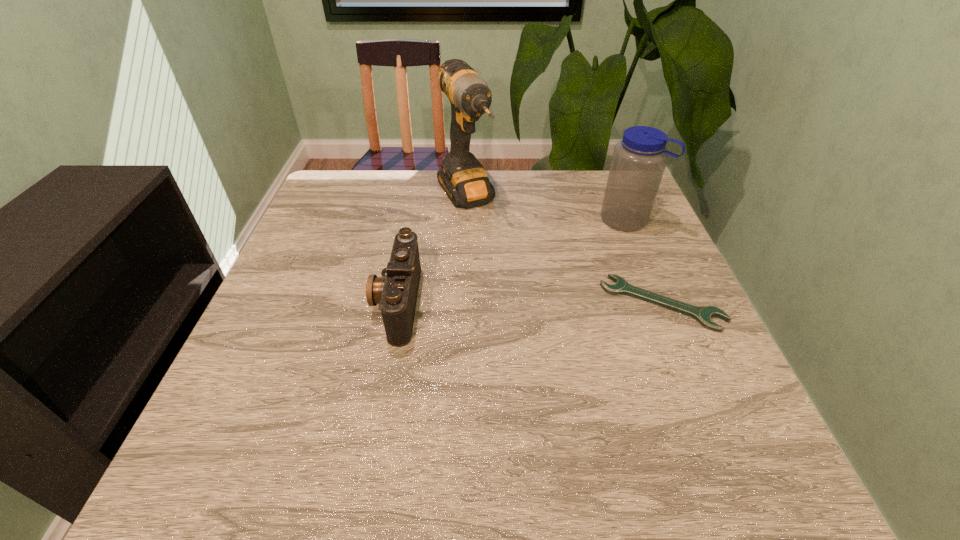
Where is `empty space that is in between the wrench and the camera`? empty space that is in between the wrench and the camera is located at coordinates tap(530, 303).

Identify the location of vacant space in between the wrench and the water bottle. (644, 261).

Where is `unoccupied area between the third tallest object and the water bottle`? unoccupied area between the third tallest object and the water bottle is located at coordinates (512, 261).

Where is `vacant space that's between the wrench and the second tallest object`? vacant space that's between the wrench and the second tallest object is located at coordinates (644, 261).

This screenshot has height=540, width=960. What are the coordinates of `vacant space that's between the leftmost object and the shortest object` in the screenshot? It's located at tap(530, 303).

Where is `free space between the second object from left to right and the shortest object`? free space between the second object from left to right and the shortest object is located at coordinates (564, 251).

Find the location of a particular element. The height and width of the screenshot is (540, 960). vacant area that lies between the shortest object and the tallest object is located at coordinates (564, 251).

Where is `object that stands as the closest to the camera`? The image size is (960, 540). object that stands as the closest to the camera is located at coordinates (463, 178).

Identify the location of object that is the closest to the third object from right to left. (396, 291).

Identify the location of free spot that satisfies the following two spatial constraints: 1. on the front side of the water bottle; 2. on the right side of the shortest object. This screenshot has width=960, height=540. point(660,303).